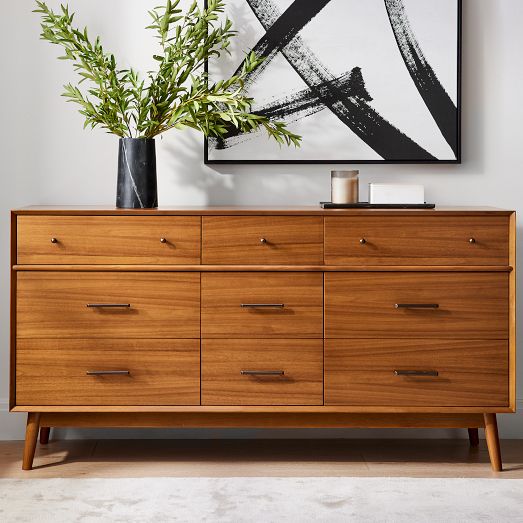
Locate an element on the screen. The width and height of the screenshot is (523, 523). dresser's shadow is located at coordinates (277, 450).